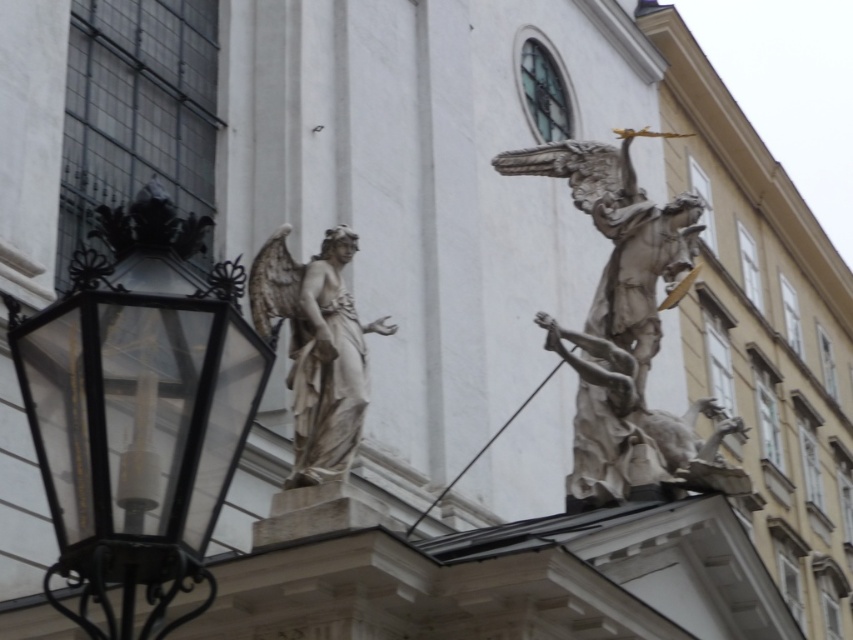
Which is behind, point (231, 317) or point (329, 364)?

Point (329, 364)

Where is `black glass lantern at left`? Image resolution: width=853 pixels, height=640 pixels. black glass lantern at left is located at coordinates (138, 410).

Between white marble sculpture at upper right and smooth white bird at center, which one appears on the left side from the viewer's perspective?

Positioned to the left is smooth white bird at center.

Can you confirm if white marble sculpture at upper right is positioned to the right of smooth white bird at center?

Correct, you'll find white marble sculpture at upper right to the right of smooth white bird at center.

This screenshot has width=853, height=640. Identify the location of white marble sculpture at upper right. (627, 332).

From the picture: Can you confirm if white marble sculpture at upper right is positioned below white marble statue at center?

No, white marble sculpture at upper right is not below white marble statue at center.

Who is more distant from viewer, [631,240] or [316,476]?

Positioned behind is point [631,240].

What are the coordinates of `white marble sculpture at upper right` in the screenshot? It's located at (627, 332).